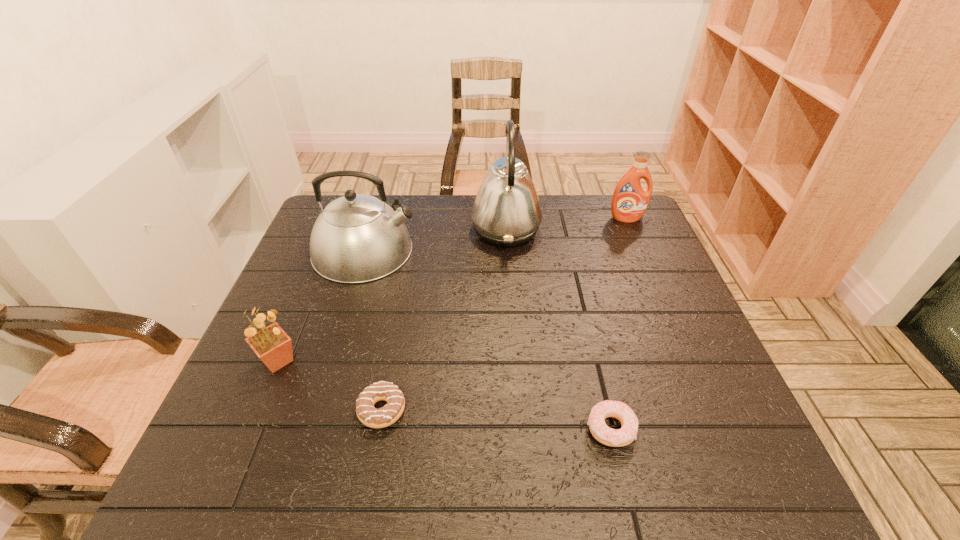
Identify the location of blank area located 0.200m from the spout of the right kettle. The height and width of the screenshot is (540, 960). (406, 229).

I want to click on vacant point located from the spout of the right kettle, so click(x=435, y=229).

Locate an element on the screen. Image resolution: width=960 pixels, height=540 pixels. vacant space situated from the spout of the shorter kettle is located at coordinates (479, 251).

Locate an element on the screen. The width and height of the screenshot is (960, 540). free space located on the front-facing side of the detergent is located at coordinates [642, 254].

What are the coordinates of `vacant region located 0.200m at the front of the fourth tallest object with flowers visible` in the screenshot? It's located at [390, 361].

Identify the location of free space located on the back of the right doughnut. The height and width of the screenshot is (540, 960). (595, 363).

The width and height of the screenshot is (960, 540). I want to click on vacant space located 0.230m on the left of the left doughnut, so click(x=245, y=410).

This screenshot has height=540, width=960. Find the location of `detergent that is at the far edge`. detergent that is at the far edge is located at coordinates point(629,202).

Locate an element on the screen. This screenshot has width=960, height=540. object positioned at the near edge is located at coordinates (601, 432).

Where is `kettle present at the left edge`? The height and width of the screenshot is (540, 960). kettle present at the left edge is located at coordinates (357, 238).